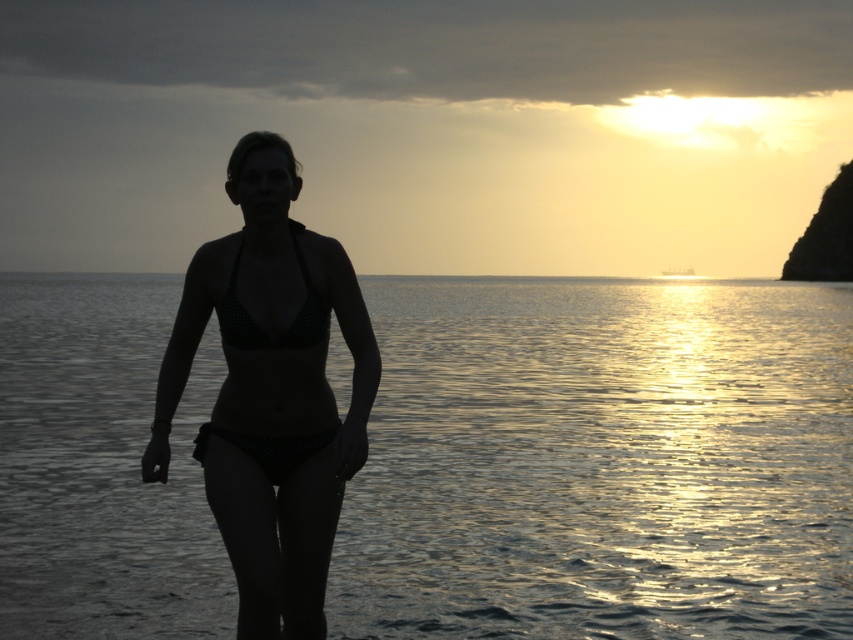
You are a photographer trying to capture the sunset scene. You notice the glistening water at center and the black dotted bikini at center. Which object should you focus on if you want to highlight the larger subject in your photo?

The glistening water at center is larger in size than the black dotted bikini at center, so focusing on the glistening water at center would highlight the larger subject.

You are a photographer trying to capture the perfect sunset shot. You have two points of interest marked in the scene. The first is at point [320,317] and the second is at point [228,170]. If you want to focus on the closer object to the camera, which point should you select?

Point [228,170] is closer to the camera than point [320,317], so you should select point [228,170] to focus on the closer object.

You are a photographer trying to capture the sunset scene. You notice a point at coordinates point (258, 324) in the image. Based on the scene description, where would this point most likely be located on the black dotted fabric bikini at center?

The point (258, 324) is located on the black dotted fabric bikini at center.